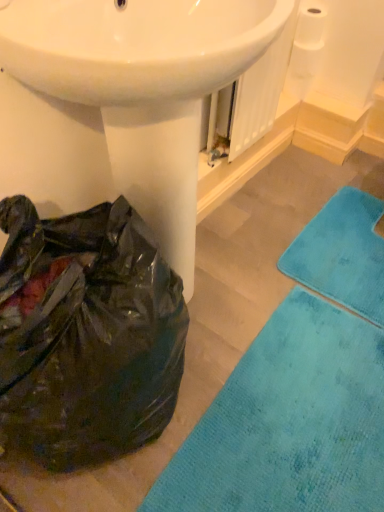
Where is `black plastic bag at lower left`? The width and height of the screenshot is (384, 512). black plastic bag at lower left is located at coordinates (86, 334).

Identify the location of teal plush bath towel at lower right. The height and width of the screenshot is (512, 384). (342, 254).

The width and height of the screenshot is (384, 512). I want to click on white matte toilet paper at upper right, so click(311, 25).

From the image's perspective, relative to teal plush bath towel at lower right, is black plastic bag at lower left above or below?

black plastic bag at lower left is below teal plush bath towel at lower right.

Is black plastic bag at lower left aimed at teal plush bath towel at lower right?

No, black plastic bag at lower left does not turn towards teal plush bath towel at lower right.

Considering their positions, is black plastic bag at lower left located in front of or behind teal plush bath towel at lower right?

black plastic bag at lower left is in front of teal plush bath towel at lower right.

Considering the relative sizes of white matte toilet paper at upper right and teal plush bath towel at lower right in the image provided, is white matte toilet paper at upper right bigger than teal plush bath towel at lower right?

No, white matte toilet paper at upper right is not bigger than teal plush bath towel at lower right.

From a real-world perspective, between white matte toilet paper at upper right and teal plush bath towel at lower right, who is vertically higher?

white matte toilet paper at upper right is physically above.

From the picture: From the image's perspective, which one is positioned higher, white matte toilet paper at upper right or teal plush bath towel at lower right?

→ From the image's view, white matte toilet paper at upper right is above.

Based on the photo, is white matte toilet paper at upper right positioned with its back to teal plush bath towel at lower right?

white matte toilet paper at upper right is not turned away from teal plush bath towel at lower right.

From a real-world perspective, which is physically below, black plastic bag at lower left or white matte toilet paper at upper right?

In real-world perspective, black plastic bag at lower left is lower.

Where is `toilet paper lying on the right of black plastic bag at lower left`? toilet paper lying on the right of black plastic bag at lower left is located at coordinates (311, 25).

Can you confirm if black plastic bag at lower left is thinner than white matte toilet paper at upper right?

No.

Considering the relative sizes of teal plush bath towel at lower right and white matte toilet paper at upper right in the image provided, is teal plush bath towel at lower right smaller than white matte toilet paper at upper right?

No, teal plush bath towel at lower right is not smaller than white matte toilet paper at upper right.

Could you tell me if teal plush bath towel at lower right is turned towards white matte toilet paper at upper right?

No, teal plush bath towel at lower right is not oriented towards white matte toilet paper at upper right.

Considering the points (337, 237) and (319, 21), which point is behind, point (337, 237) or point (319, 21)?

The point (319, 21) is farther.

From the image's perspective, is teal soft rug at lower right located above or below teal plush bath towel at lower right?

From the image's perspective, teal soft rug at lower right appears below teal plush bath towel at lower right.

Can you confirm if teal soft rug at lower right is bigger than teal plush bath towel at lower right?

Yes, teal soft rug at lower right is bigger than teal plush bath towel at lower right.

Based on the photo, who is more distant, teal soft rug at lower right or teal plush bath towel at lower right?

teal plush bath towel at lower right is more distant.

Is teal soft rug at lower right to the left or to the right of teal plush bath towel at lower right in the image?

teal soft rug at lower right is positioned on teal plush bath towel at lower right's left side.

Can you tell me how much white glossy sink at center and teal plush bath towel at lower right differ in facing direction?

There is a 88.1-degree angle between the facing directions of white glossy sink at center and teal plush bath towel at lower right.

Is white glossy sink at center thinner than teal plush bath towel at lower right?

Yes, white glossy sink at center is thinner than teal plush bath towel at lower right.

Could you tell me if white glossy sink at center is turned towards teal plush bath towel at lower right?

No.

In terms of size, does white glossy sink at center appear bigger or smaller than teal plush bath towel at lower right?

Clearly, white glossy sink at center is larger in size than teal plush bath towel at lower right.

Which is in front, teal soft rug at lower right or white matte toilet paper at upper right?

teal soft rug at lower right.

Which of these two, teal soft rug at lower right or white matte toilet paper at upper right, is bigger?

teal soft rug at lower right is bigger.

Looking at this image, does teal soft rug at lower right touch white matte toilet paper at upper right?

No, teal soft rug at lower right is not touching white matte toilet paper at upper right.

Does teal soft rug at lower right have a greater width compared to white matte toilet paper at upper right?

Indeed, teal soft rug at lower right has a greater width compared to white matte toilet paper at upper right.

The width and height of the screenshot is (384, 512). Identify the location of paper bag in front of the teal plush bath towel at lower right. (86, 334).

I want to click on toilet paper behind the teal plush bath towel at lower right, so click(311, 25).

Looking at the image, which one is located further to black plastic bag at lower left, white glossy sink at center or teal soft rug at lower right?

teal soft rug at lower right is further to black plastic bag at lower left.

From the image, which object appears to be nearer to black plastic bag at lower left, white glossy sink at center or white matte toilet paper at upper right?

white glossy sink at center is positioned closer to the anchor black plastic bag at lower left.

Looking at the image, which one is located closer to white glossy sink at center, teal soft rug at lower right or white matte toilet paper at upper right?

teal soft rug at lower right lies closer to white glossy sink at center than the other object.

Consider the image. Estimate the real-world distances between objects in this image. Which object is further from teal plush bath towel at lower right, black plastic bag at lower left or white glossy sink at center?

black plastic bag at lower left.

Which object lies nearer to the anchor point teal plush bath towel at lower right, white glossy sink at center or black plastic bag at lower left?

white glossy sink at center.

From the image, which object appears to be farther from white glossy sink at center, teal soft rug at lower right or black plastic bag at lower left?

The object further to white glossy sink at center is teal soft rug at lower right.

Considering their positions, is white glossy sink at center positioned further to teal soft rug at lower right than black plastic bag at lower left?

white glossy sink at center.

Estimate the real-world distances between objects in this image. Which object is further from black plastic bag at lower left, teal plush bath towel at lower right or white glossy sink at center?

teal plush bath towel at lower right is positioned further to the anchor black plastic bag at lower left.

I want to click on bath mat between white glossy sink at center and teal plush bath towel at lower right along the z-axis, so click(x=289, y=422).

This screenshot has width=384, height=512. In order to click on sink between white matte toilet paper at upper right and teal soft rug at lower right in the vertical direction in this screenshot , I will do `click(143, 86)`.

Locate an element on the screen. The height and width of the screenshot is (512, 384). bath towel between white glossy sink at center and white matte toilet paper at upper right in the front-back direction is located at coordinates (342, 254).

This screenshot has height=512, width=384. I want to click on paper bag between white matte toilet paper at upper right and teal soft rug at lower right from top to bottom, so click(x=86, y=334).